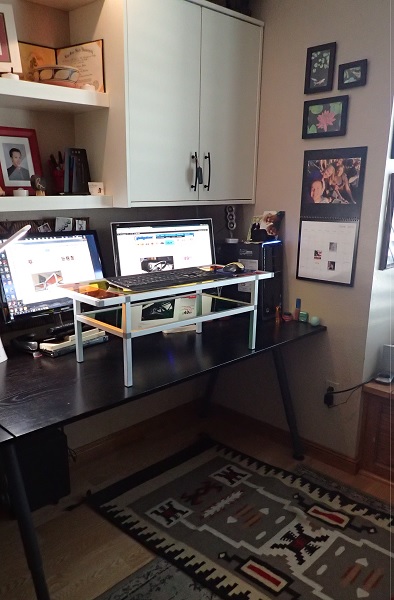
The image size is (394, 600). In order to click on cabinet doors in this screenshot , I will do `click(156, 151)`, `click(235, 120)`.